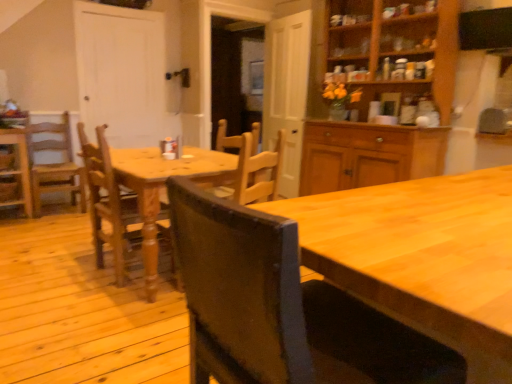
Find the location of a particular element. The image size is (512, 384). free space between wooden chair at center, which appears as the 2th chair when viewed from the right, and wooden chair at left, which is the 2th chair in back-to-front order is located at coordinates (54, 241).